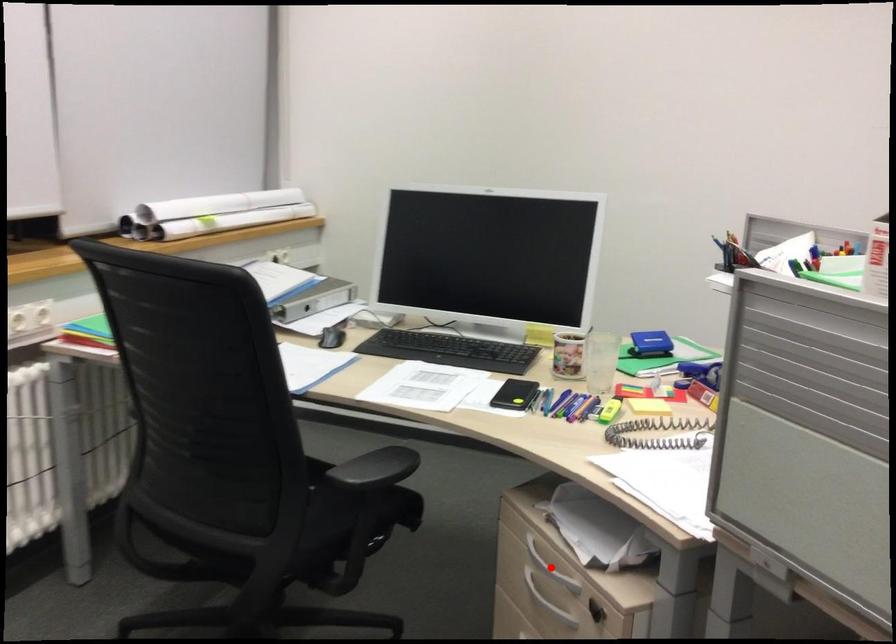
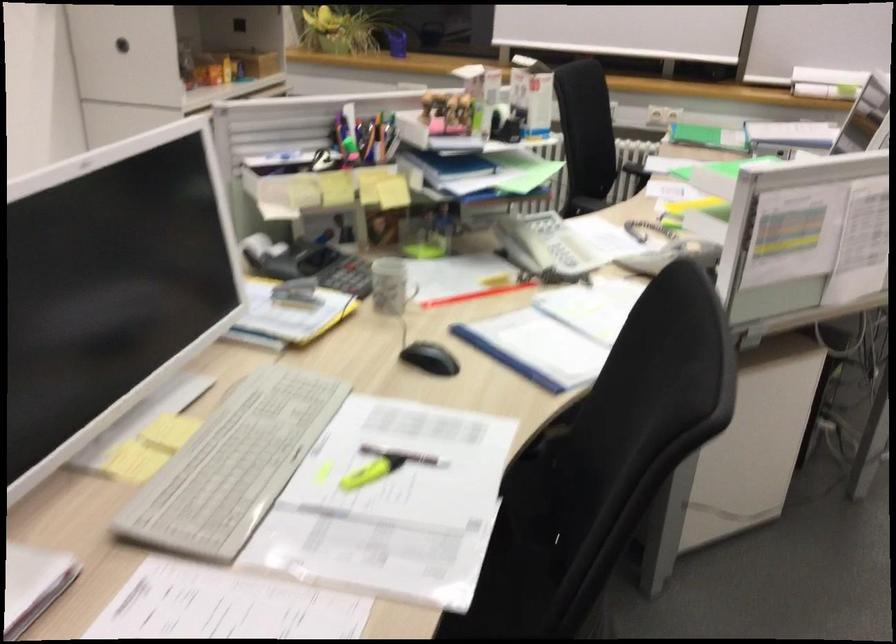
Question: I am providing you with two images of the same scene from different viewpoints. A red point is marked on the first image. At the location where the point appears in image 1, is it still visible in image 2?

Choices:
 (A) Yes
 (B) No

Answer: (B)